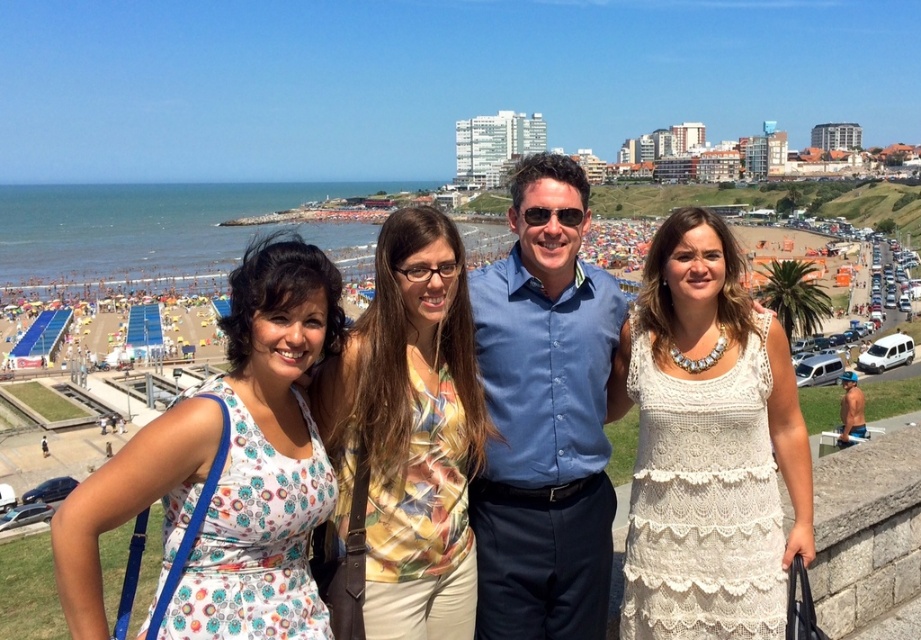
In the scene shown: Which is more to the left, blue button-down shirt at center or tan skin man at center?

blue button-down shirt at center

Does blue button-down shirt at center appear on the right side of tan skin man at center?

Incorrect, blue button-down shirt at center is not on the right side of tan skin man at center.

Does point (604, 365) come in front of point (859, 419)?

That is True.

Locate an element on the screen. The width and height of the screenshot is (921, 640). blue button-down shirt at center is located at coordinates (545, 416).

Does white floral dress at left appear on the right side of printed fabric blouse at center?

In fact, white floral dress at left is to the left of printed fabric blouse at center.

Does white floral dress at left have a lesser width compared to printed fabric blouse at center?

No, white floral dress at left is not thinner than printed fabric blouse at center.

The width and height of the screenshot is (921, 640). Describe the element at coordinates (225, 472) in the screenshot. I see `white floral dress at left` at that location.

Where is `white floral dress at left`? white floral dress at left is located at coordinates (225, 472).

Does white floral dress at left appear over tan skin man at center?

No, white floral dress at left is not above tan skin man at center.

Does white floral dress at left have a smaller size compared to tan skin man at center?

No.

Which is behind, point (264, 342) or point (854, 422)?

Point (854, 422)

What are the coordinates of `white floral dress at left` in the screenshot? It's located at (225, 472).